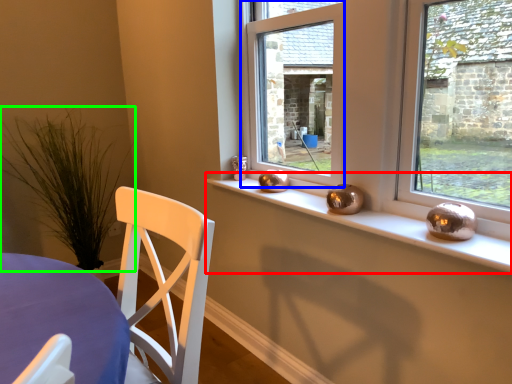
Question: Which object is positioned farthest from window sill (highlighted by a red box)? Select from window (highlighted by a blue box) and plant (highlighted by a green box).

Choices:
 (A) window
 (B) plant

Answer: (B)